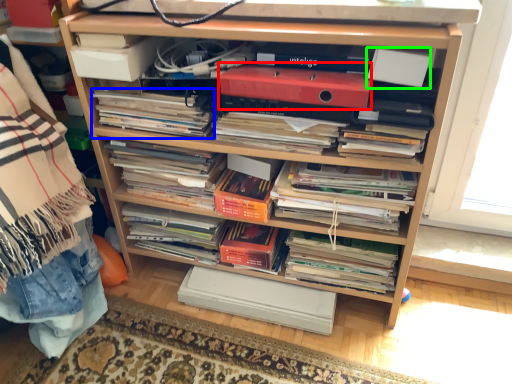
Question: Estimate the real-world distances between objects in this image. Which object is closer to paperback book (highlighted by a red box), magazine (highlighted by a blue box) or paperback book (highlighted by a green box)?

Choices:
 (A) magazine
 (B) paperback book

Answer: (B)